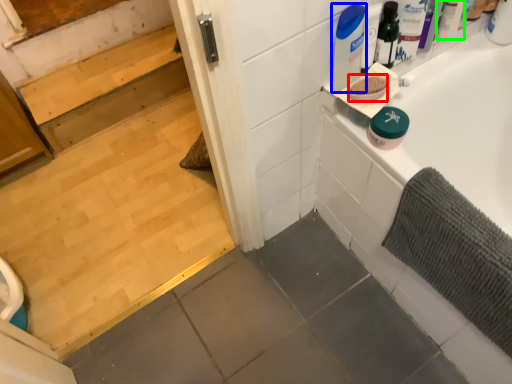
Question: Estimate the real-world distances between objects in this image. Which object is closer to soap (highlighted by a red box), cleaning product (highlighted by a blue box) or toiletry (highlighted by a green box)?

Choices:
 (A) cleaning product
 (B) toiletry

Answer: (A)